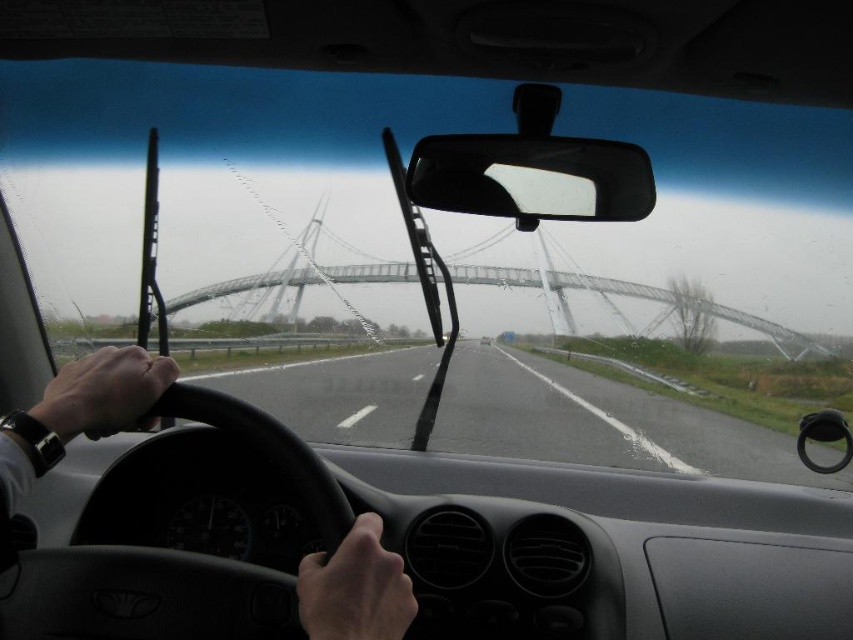
Question: Observing the image, what is the correct spatial positioning of asphalt road at center in reference to black leather steering wheel at center?

Choices:
 (A) left
 (B) right

Answer: (B)

Question: Which object is closer to the camera taking this photo?

Choices:
 (A) black leather steering wheel at center
 (B) transparent glass bridge at center

Answer: (A)

Question: Which point is closer to the camera?

Choices:
 (A) (6, 449)
 (B) (546, 276)
 (C) (827, 481)

Answer: (A)

Question: Is asphalt road at center to the right of black leather steering wheel at center from the viewer's perspective?

Choices:
 (A) no
 (B) yes

Answer: (B)

Question: Which point is farther to the camera?

Choices:
 (A) transparent glass bridge at center
 (B) asphalt road at center
 (C) black leather steering wheel at center

Answer: (A)

Question: Does asphalt road at center appear under black leather steering wheel at center?

Choices:
 (A) no
 (B) yes

Answer: (B)